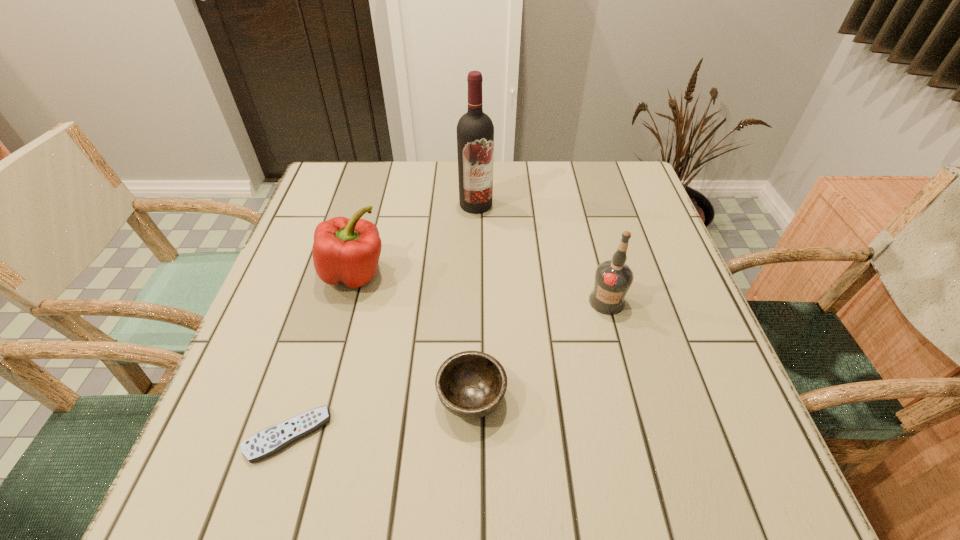
In the image, there is a desktop. Identify the location of free space at the left edge. The height and width of the screenshot is (540, 960). (328, 310).

Locate an element on the screen. vacant space at the right edge is located at coordinates (740, 408).

Locate an element on the screen. This screenshot has width=960, height=540. vacant space at the far left corner is located at coordinates (353, 186).

I want to click on free space at the far right corner of the desktop, so click(x=621, y=164).

Find the location of a particular element. The height and width of the screenshot is (540, 960). free space between the remote control and the bowl is located at coordinates (379, 416).

At what (x,y) coordinates should I click in order to perform the action: click on vacant point located between the bowl and the third tallest object. Please return your answer as a coordinate pair (x, y). This screenshot has width=960, height=540. Looking at the image, I should click on (413, 335).

This screenshot has height=540, width=960. I want to click on vacant area that lies between the vodka and the tallest object, so click(x=541, y=253).

I want to click on vacant area between the vodka and the third shortest object, so click(481, 287).

I want to click on unoccupied position between the shortest object and the bowl, so click(379, 416).

Locate an element on the screen. The width and height of the screenshot is (960, 540). free space between the tallest object and the bowl is located at coordinates (474, 301).